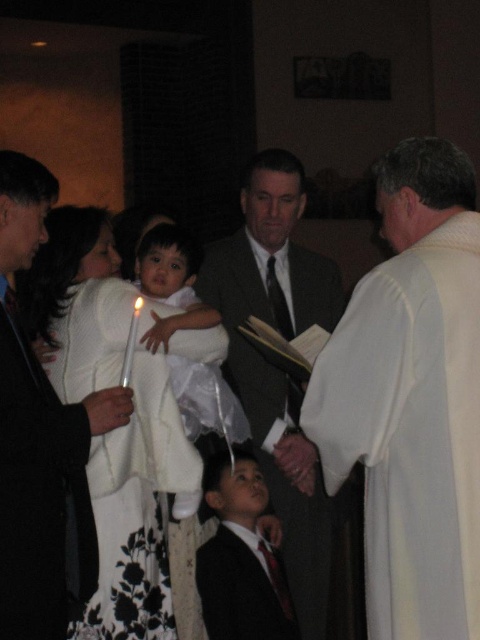
Can you confirm if white satin baby at center is wider than white wax candle at center?

Correct, the width of white satin baby at center exceeds that of white wax candle at center.

Does white satin baby at center have a smaller size compared to white wax candle at center?

No, white satin baby at center is not smaller than white wax candle at center.

Which is behind, point (211, 404) or point (140, 310)?

The point (211, 404) is behind.

In order to click on white satin baby at center in this screenshot , I will do [170, 282].

Between dark suit at center and smooth white robe at center, which one is positioned lower?

smooth white robe at center

Measure the distance between dark suit at center and camera.

dark suit at center is 12.16 feet away from camera.

Measure the distance between point (236,392) and camera.

Point (236,392) is 3.74 meters away from camera.

Locate an element on the screen. Image resolution: width=480 pixels, height=640 pixels. dark suit at center is located at coordinates (276, 365).

Who is taller, dark suit at center or white cotton suit at center?

dark suit at center is taller.

Which is behind, point (299, 214) or point (0, 227)?

The point (299, 214) is behind.

Identify the location of dark suit at center. pyautogui.click(x=276, y=365).